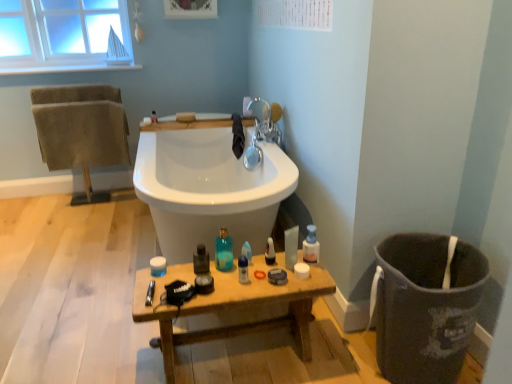
Image resolution: width=512 pixels, height=384 pixels. I want to click on empty space that is ontop of wooden table at lower center (from a real-world perspective), so click(225, 269).